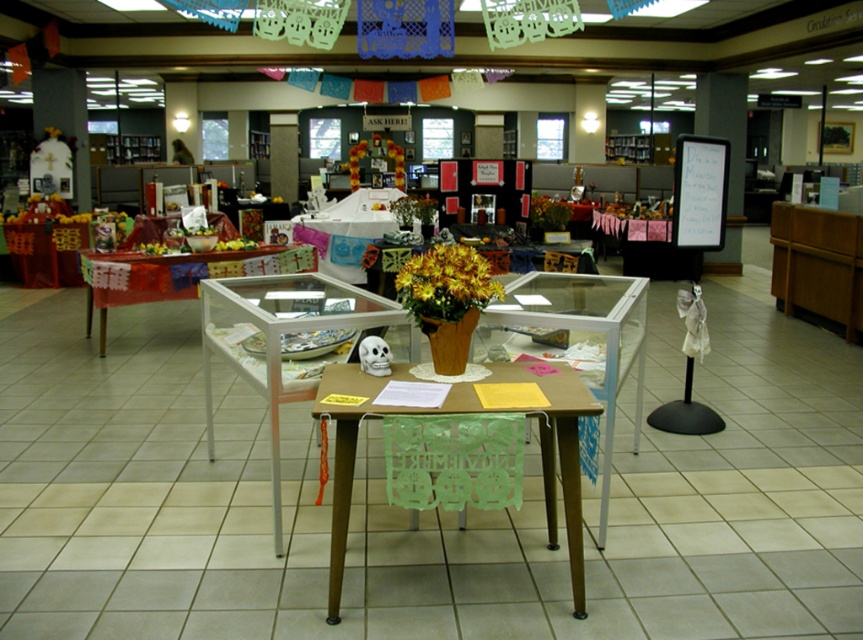
Is translucent glass table at center behind yellow matte flower pot at center?

Yes, translucent glass table at center is further from the viewer.

Find the location of `translucent glass table at center`. translucent glass table at center is located at coordinates (177, 275).

Is point (345, 483) less distant than point (391, 148)?

Yes.

This screenshot has height=640, width=863. I want to click on brown wooden table at center, so click(463, 412).

Who is more forward, (490, 378) or (392, 156)?

Point (490, 378) is in front.

What are the coordinates of `brown wooden table at center` in the screenshot? It's located at (463, 412).

Does yellow matte flower pot at center come in front of whiteboard at upper right?

Yes, it is in front of whiteboard at upper right.

Does yellow matte flower pot at center have a greater width compared to whiteboard at upper right?

No.

Does point (433, 280) lie in front of point (684, 140)?

Yes, it is in front of point (684, 140).

Where is `yellow matte flower pot at center`? Image resolution: width=863 pixels, height=640 pixels. yellow matte flower pot at center is located at coordinates (446, 282).